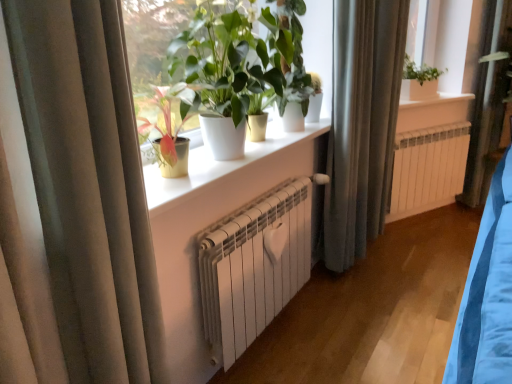
Question: From a real-world perspective, is silky gray curtain at center, which is the second curtain in front-to-back order, beneath white ceramic window sill at upper center, the first window sill positioned from the top?

Choices:
 (A) yes
 (B) no

Answer: (A)

Question: Is silky gray curtain at center, the 1th curtain positioned from the back, thinner than white ceramic window sill at upper center, the first window sill from the back?

Choices:
 (A) yes
 (B) no

Answer: (A)

Question: Considering the relative sizes of silky gray curtain at center, which is the second curtain from left to right, and white ceramic window sill at upper center, the 2th window sill from the front, in the image provided, is silky gray curtain at center, which is the second curtain from left to right, taller than white ceramic window sill at upper center, the 2th window sill from the front,?

Choices:
 (A) no
 (B) yes

Answer: (B)

Question: Is white ceramic window sill at upper center, the first window sill from the back, at the back of silky gray curtain at center, which is the second curtain in front-to-back order?

Choices:
 (A) no
 (B) yes

Answer: (A)

Question: Would you consider silky gray curtain at center, the 1th curtain positioned from the back, to be distant from white ceramic window sill at upper center, the first window sill from the back?

Choices:
 (A) no
 (B) yes

Answer: (A)

Question: Is white ceramic window sill at upper center, the second window sill from the left, in front of or behind green glossy plant at center, which is the 1th houseplant from back to front, in the image?

Choices:
 (A) behind
 (B) front

Answer: (A)

Question: From the image's perspective, relative to green glossy plant at center, which is counted as the second houseplant, starting from the front, is white ceramic window sill at upper center, the first window sill positioned from the top, above or below?

Choices:
 (A) above
 (B) below

Answer: (A)

Question: In terms of height, does white ceramic window sill at upper center, the second window sill from the left, look taller or shorter compared to green glossy plant at center, which is the 1th houseplant from back to front?

Choices:
 (A) short
 (B) tall

Answer: (A)

Question: Considering the positions of white ceramic window sill at upper center, which is counted as the 1th window sill, starting from the right, and green glossy plant at center, which is counted as the second houseplant, starting from the front, in the image, is white ceramic window sill at upper center, which is counted as the 1th window sill, starting from the right, bigger or smaller than green glossy plant at center, which is counted as the second houseplant, starting from the front,?

Choices:
 (A) small
 (B) big

Answer: (A)

Question: Considering the positions of beige fabric curtain at left, marked as the second curtain in a back-to-front arrangement, and white ceramic window sill at upper center, which is the second window sill from bottom to top, in the image, is beige fabric curtain at left, marked as the second curtain in a back-to-front arrangement, wider or thinner than white ceramic window sill at upper center, which is the second window sill from bottom to top,?

Choices:
 (A) wide
 (B) thin

Answer: (B)

Question: From their relative heights in the image, would you say beige fabric curtain at left, marked as the 2th curtain in a right-to-left arrangement, is taller or shorter than white ceramic window sill at upper center, the first window sill positioned from the top?

Choices:
 (A) tall
 (B) short

Answer: (A)

Question: From the image's perspective, is beige fabric curtain at left, placed as the 1th curtain when sorted from left to right, positioned above or below white ceramic window sill at upper center, the second window sill from the left?

Choices:
 (A) above
 (B) below

Answer: (B)

Question: Relative to white ceramic window sill at upper center, which is the second window sill from bottom to top, is beige fabric curtain at left, marked as the second curtain in a back-to-front arrangement, in front or behind?

Choices:
 (A) front
 (B) behind

Answer: (A)

Question: Considering their positions, is white matte radiator at center located in front of or behind white ceramic window sill at upper center, the second window sill from the left?

Choices:
 (A) front
 (B) behind

Answer: (A)

Question: Is point (273, 276) positioned closer to the camera than point (408, 99)?

Choices:
 (A) farther
 (B) closer

Answer: (B)